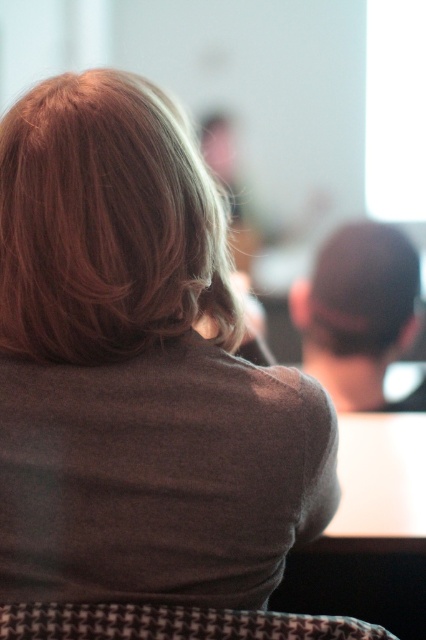
Is brown matte shirt at upper left bigger than blonde silky hair at upper left?

Yes.

Does brown matte shirt at upper left appear over blonde silky hair at upper left?

Incorrect, brown matte shirt at upper left is not positioned above blonde silky hair at upper left.

Who is more forward, (170, 100) or (164, 163)?

Point (164, 163) is more forward.

At what (x,y) coordinates should I click in order to perform the action: click on brown matte shirt at upper left. Please return your answer as a coordinate pair (x, y). The image size is (426, 640). Looking at the image, I should click on (137, 369).

Who is shorter, brown matte shirt at upper left or houndstooth fabric chair at lower center?

houndstooth fabric chair at lower center

Which is more to the left, brown matte shirt at upper left or houndstooth fabric chair at lower center?

From the viewer's perspective, brown matte shirt at upper left appears more on the left side.

Who is more forward, (181, 282) or (2, 620)?

Point (2, 620) is in front.

I want to click on brown matte shirt at upper left, so click(137, 369).

Who is shorter, brown matte shirt at upper left or dark brown hair at center?

With less height is dark brown hair at center.

Where is `brown matte shirt at upper left`? brown matte shirt at upper left is located at coordinates (137, 369).